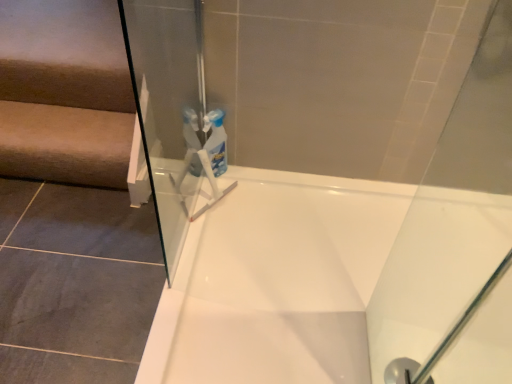
Identify the location of vacant space behind transparent glass shower at lower right. (394, 324).